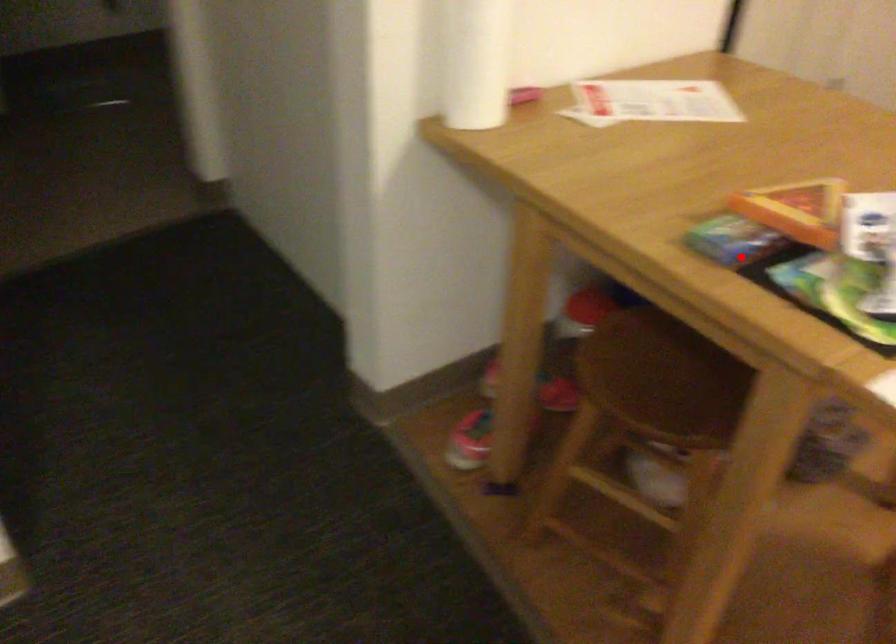
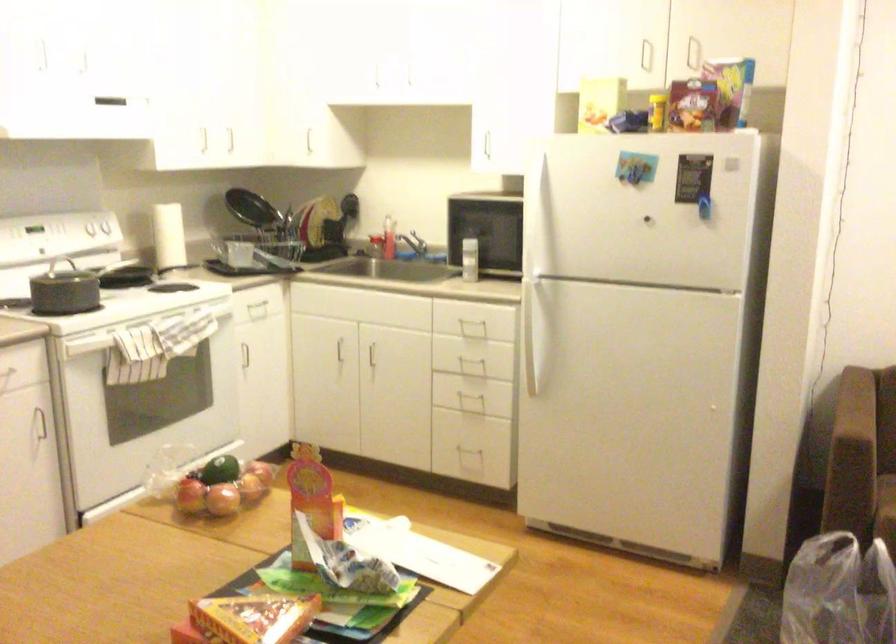
The point at the highlighted location is marked in the first image. Where is the corresponding point in the second image?

(253, 617)